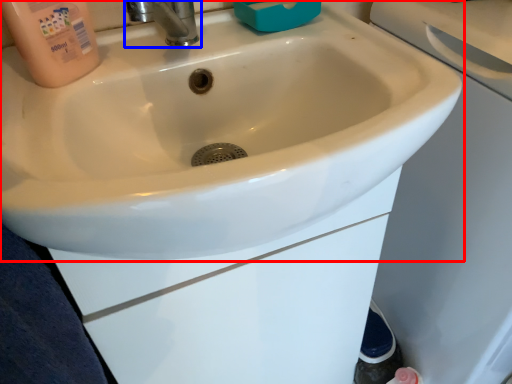
Question: Which point is further to the camera, sink (highlighted by a red box) or tap (highlighted by a blue box)?

Choices:
 (A) sink
 (B) tap

Answer: (B)